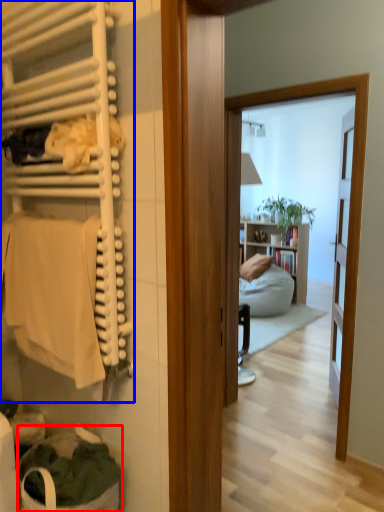
Question: Which object is closer to the camera taking this photo, laundry basket (highlighted by a red box) or closet (highlighted by a blue box)?

Choices:
 (A) laundry basket
 (B) closet

Answer: (B)